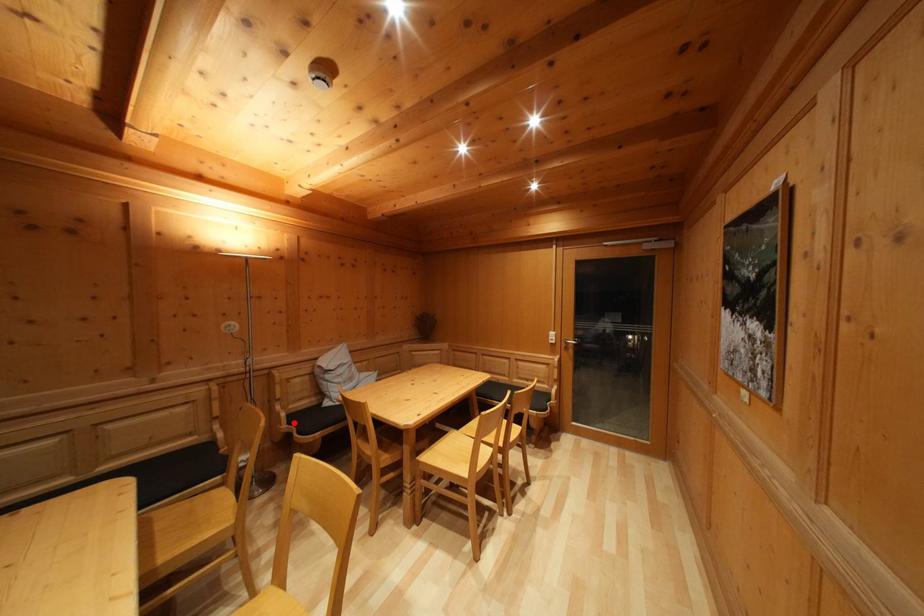
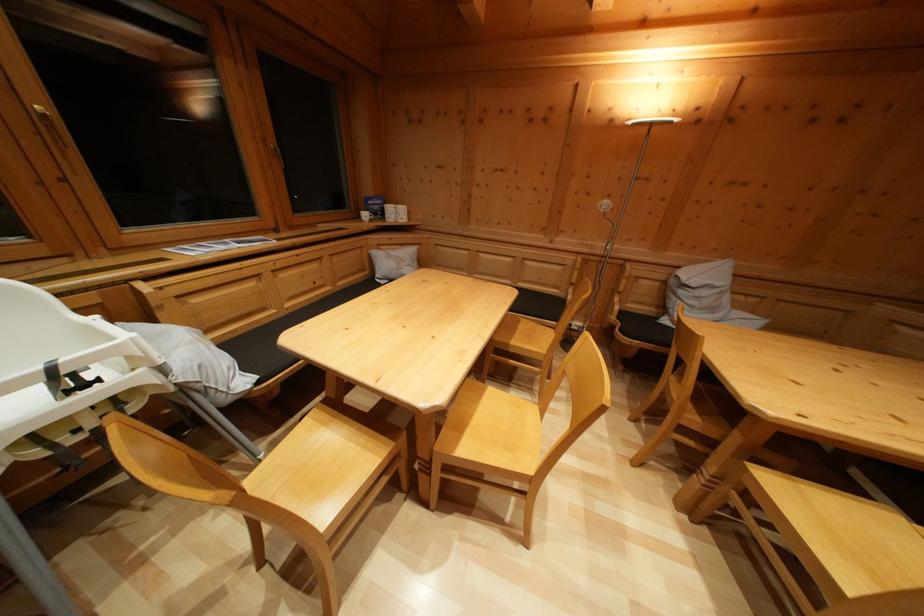
Question: I am providing you with two images of the same scene from different viewpoints. A red point is shown in image1. For the corresponding object point in image2, is it positioned nearer or farther from the camera?

Choices:
 (A) Nearer
 (B) Farther

Answer: (A)